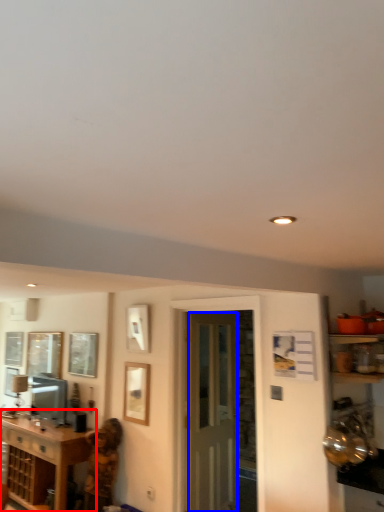
Question: Among these objects, which one is nearest to the camera, cabinetry (highlighted by a red box) or screen door (highlighted by a blue box)?

Choices:
 (A) cabinetry
 (B) screen door

Answer: (B)